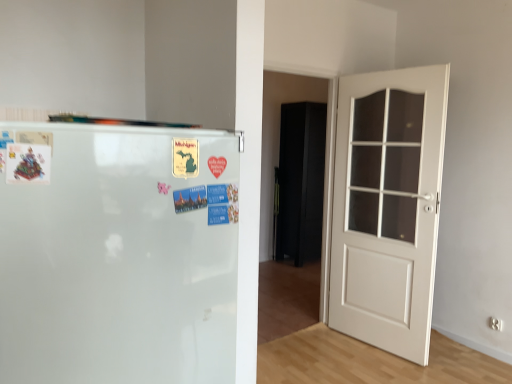
In order to face clear glass door at right, should I rotate leftwards or rightwards?

Turn right approximately 17.718 degrees to face it.

What do you see at coordinates (117, 253) in the screenshot? I see `white glossy refrigerator at left` at bounding box center [117, 253].

Where is `clear glass door at right`? Image resolution: width=512 pixels, height=384 pixels. clear glass door at right is located at coordinates (386, 164).

Locate an element on the screen. armoire to the left of clear glass door at right is located at coordinates coord(301,181).

From the picture: Considering the relative sizes of black matte armoire at center and clear glass door at right in the image provided, is black matte armoire at center shorter than clear glass door at right?

Incorrect, the height of black matte armoire at center does not fall short of that of clear glass door at right.

Which is nearer, (308,116) or (398,200)?

Clearly, point (308,116) is more distant from the camera than point (398,200).

Is black matte armoire at center directly adjacent to clear glass door at right?

There is a gap between black matte armoire at center and clear glass door at right.

Between clear glass door at right and white wooden door at right, which one is positioned behind?

clear glass door at right is more distant.

Can you confirm if clear glass door at right is wider than white wooden door at right?

Indeed, clear glass door at right has a greater width compared to white wooden door at right.

In the scene shown: Can you tell me how much clear glass door at right and white wooden door at right differ in facing direction?

83.5 degrees separate the facing orientations of clear glass door at right and white wooden door at right.

Between white wooden door at right and white glossy refrigerator at left, which one has more height?

With more height is white wooden door at right.

From a real-world perspective, is white wooden door at right on top of white glossy refrigerator at left?

No.

Is white wooden door at right situated inside white glossy refrigerator at left or outside?

white wooden door at right is not inside white glossy refrigerator at left, it's outside.

What's the angular difference between white wooden door at right and white glossy refrigerator at left's facing directions?

The facing directions of white wooden door at right and white glossy refrigerator at left are 83.5 degrees apart.

Between black matte armoire at center and white wooden door at right, which one appears on the left side from the viewer's perspective?

black matte armoire at center.

Between black matte armoire at center and white wooden door at right, which one is positioned in front?

white wooden door at right is more forward.

In the scene shown: Does black matte armoire at center have a greater width compared to white wooden door at right?

Correct, the width of black matte armoire at center exceeds that of white wooden door at right.

Can you confirm if black matte armoire at center is bigger than white wooden door at right?

Incorrect, black matte armoire at center is not larger than white wooden door at right.

Locate an element on the screen. The image size is (512, 384). armoire lying above the white glossy refrigerator at left (from the image's perspective) is located at coordinates (301, 181).

Which of these two, black matte armoire at center or white glossy refrigerator at left, stands taller?

Standing taller between the two is black matte armoire at center.

From a real-world perspective, relative to white glossy refrigerator at left, is black matte armoire at center vertically above or below?

From a real-world perspective, black matte armoire at center is physically below white glossy refrigerator at left.

Consider the image. Is black matte armoire at center aimed at white glossy refrigerator at left?

No, black matte armoire at center is not facing towards white glossy refrigerator at left.

Consider the image. From the image's perspective, between white wooden door at right and clear glass door at right, who is located below?

white wooden door at right is shown below in the image.

Measure the distance between white wooden door at right and clear glass door at right.

white wooden door at right and clear glass door at right are 4.40 inches apart.

Is white wooden door at right smaller than clear glass door at right?

Yes.

Looking at the image, does white glossy refrigerator at left seem bigger or smaller compared to white wooden door at right?

white glossy refrigerator at left is bigger than white wooden door at right.

From the image's perspective, does white glossy refrigerator at left appear lower than white wooden door at right?

Yes.

Is the depth of white glossy refrigerator at left less than that of white wooden door at right?

Yes, it is in front of white wooden door at right.

This screenshot has height=384, width=512. I want to click on armoire below the clear glass door at right (from the image's perspective), so click(301, 181).

The height and width of the screenshot is (384, 512). Identify the location of window behind the white wooden door at right. (386, 164).

Based on their spatial positions, is black matte armoire at center or white wooden door at right further from clear glass door at right?

Based on the image, black matte armoire at center appears to be further to clear glass door at right.

Estimate the real-world distances between objects in this image. Which object is closer to black matte armoire at center, clear glass door at right or white glossy refrigerator at left?

Based on the image, clear glass door at right appears to be nearer to black matte armoire at center.

Which object lies further to the anchor point white wooden door at right, black matte armoire at center or clear glass door at right?

black matte armoire at center is further to white wooden door at right.

Estimate the real-world distances between objects in this image. Which object is further from white wooden door at right, white glossy refrigerator at left or black matte armoire at center?

black matte armoire at center is positioned further to the anchor white wooden door at right.

Which object lies further to the anchor point white wooden door at right, clear glass door at right or black matte armoire at center?

black matte armoire at center is positioned further to the anchor white wooden door at right.

Looking at the image, which one is located closer to white glossy refrigerator at left, black matte armoire at center or clear glass door at right?

clear glass door at right lies closer to white glossy refrigerator at left than the other object.

Estimate the real-world distances between objects in this image. Which object is closer to clear glass door at right, white glossy refrigerator at left or black matte armoire at center?

white glossy refrigerator at left is positioned closer to the anchor clear glass door at right.

Considering their positions, is white glossy refrigerator at left positioned closer to clear glass door at right than white wooden door at right?

Based on the image, white wooden door at right appears to be nearer to clear glass door at right.

Identify the location of window between white wooden door at right and black matte armoire at center from front to back. (386, 164).

What are the coordinates of `door located between white glossy refrigerator at left and clear glass door at right in the depth direction` in the screenshot? It's located at (387, 207).

This screenshot has height=384, width=512. In order to click on window positioned between white glossy refrigerator at left and black matte armoire at center from near to far in this screenshot , I will do `click(386, 164)`.

Find the location of a particular element. This screenshot has width=512, height=384. door positioned between white glossy refrigerator at left and black matte armoire at center from near to far is located at coordinates (387, 207).